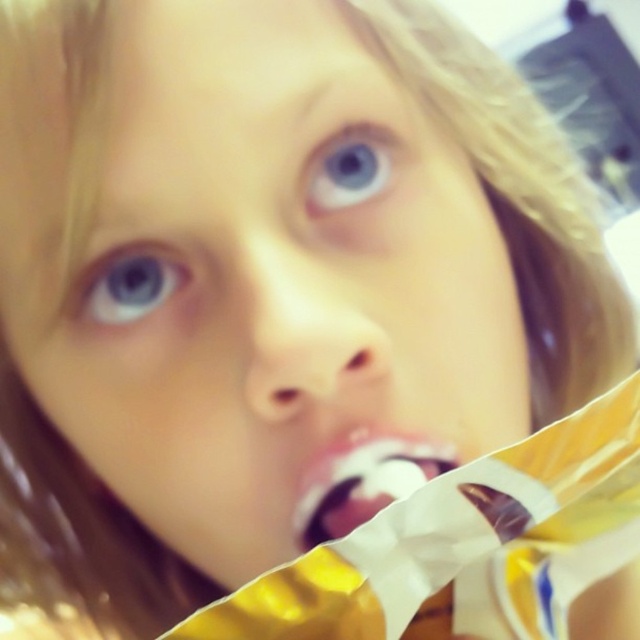
Question: Which point is farther to the camera?

Choices:
 (A) white glossy pacifier at center
 (B) blue glossy eye at upper left

Answer: (B)

Question: Does white glossy pacifier at center have a lesser width compared to blue glossy eye at upper center?

Choices:
 (A) no
 (B) yes

Answer: (A)

Question: Estimate the real-world distances between objects in this image. Which object is farther from the white glossy pacifier at center?

Choices:
 (A) blue glossy eye at upper left
 (B) blue glossy eye at upper center

Answer: (B)

Question: Which of the following is the closest to the observer?

Choices:
 (A) (88, 307)
 (B) (337, 208)
 (C) (356, 525)

Answer: (C)

Question: Is white glossy pacifier at center above blue glossy eye at upper left?

Choices:
 (A) yes
 (B) no

Answer: (B)

Question: From the image, what is the correct spatial relationship of white glossy pacifier at center in relation to blue glossy eye at upper left?

Choices:
 (A) above
 (B) below

Answer: (B)